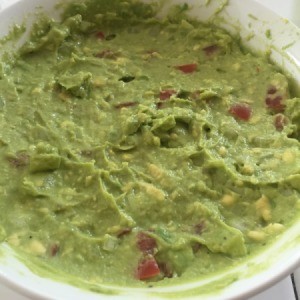
Identify the location of grout line. The height and width of the screenshot is (300, 300). (295, 284).